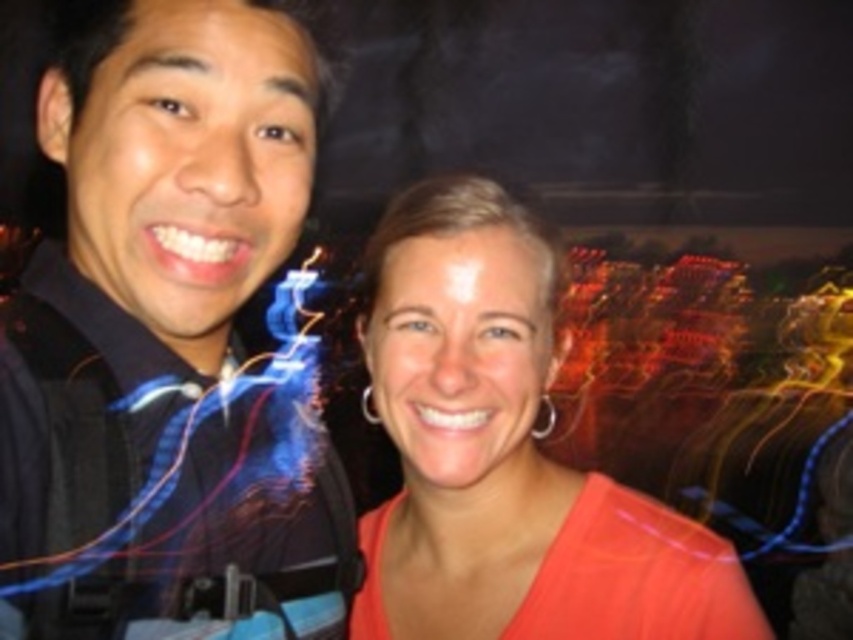
Question: Which point is closer to the camera?

Choices:
 (A) (123, 28)
 (B) (451, 612)

Answer: (A)

Question: Can you confirm if black matte shirt at left is wider than orange matte shirt at center?

Choices:
 (A) yes
 (B) no

Answer: (B)

Question: Which of the following is the closest to the observer?

Choices:
 (A) (62, 419)
 (B) (549, 296)

Answer: (A)

Question: Which point is farther from the camera taking this photo?

Choices:
 (A) (28, 280)
 (B) (602, 552)

Answer: (B)

Question: Does black matte shirt at left have a lesser width compared to orange matte shirt at center?

Choices:
 (A) yes
 (B) no

Answer: (A)

Question: Is black matte shirt at left to the right of orange matte shirt at center from the viewer's perspective?

Choices:
 (A) yes
 (B) no

Answer: (B)